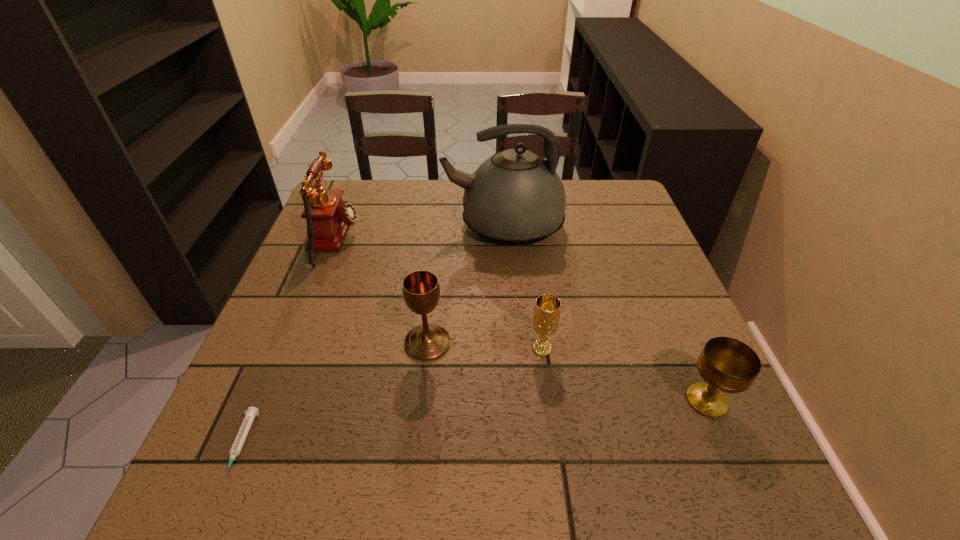
This screenshot has width=960, height=540. I want to click on object at the right edge, so click(728, 365).

The image size is (960, 540). I want to click on object located at the far left corner, so click(x=328, y=217).

Image resolution: width=960 pixels, height=540 pixels. Identify the location of object that is at the near left corner. (236, 448).

In the image, there is a desktop. Where is `vacant space at the far edge`? The image size is (960, 540). vacant space at the far edge is located at coordinates (417, 195).

The width and height of the screenshot is (960, 540). In the image, there is a desktop. What are the coordinates of `vacant space at the near edge` in the screenshot? It's located at (511, 456).

The height and width of the screenshot is (540, 960). I want to click on vacant point at the left edge, so click(x=317, y=393).

In the image, there is a desktop. Identify the location of vacant space at the right edge. This screenshot has height=540, width=960. (688, 356).

Where is `free space at the far left corner of the desktop`? free space at the far left corner of the desktop is located at coordinates (338, 188).

Where is `vacant area that lies between the fifth shortest object and the leftmost chalice`? This screenshot has width=960, height=540. vacant area that lies between the fifth shortest object and the leftmost chalice is located at coordinates (381, 291).

This screenshot has width=960, height=540. Find the location of `vacant region between the tallest chalice and the shortest object`. vacant region between the tallest chalice and the shortest object is located at coordinates (334, 394).